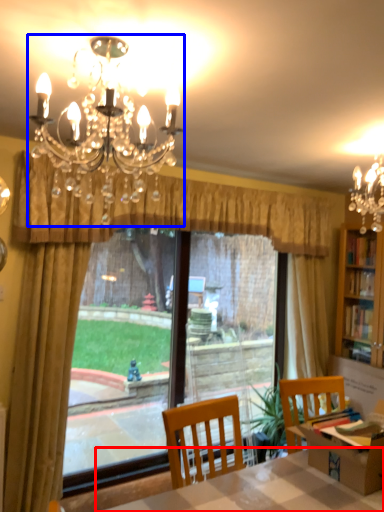
Question: Which object appears closest to the camera in this image, table (highlighted by a red box) or lamp (highlighted by a blue box)?

Choices:
 (A) table
 (B) lamp

Answer: (B)